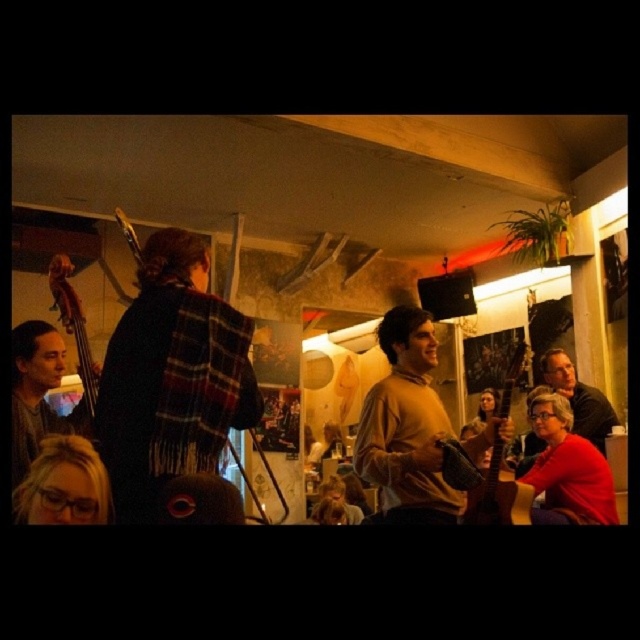
Question: Does matte brown sweater at center lie in front of matte black guitar at right?

Choices:
 (A) no
 (B) yes

Answer: (B)

Question: Which of the following is the closest to the observer?

Choices:
 (A) (88, 516)
 (B) (536, 401)
 (C) (612, 413)
 (D) (80, 316)

Answer: (A)

Question: Is wooden acoustic guitar at right below matte black double bass at left?

Choices:
 (A) yes
 (B) no

Answer: (A)

Question: Does matte black glasses at lower left appear on the right side of matte black double bass at left?

Choices:
 (A) yes
 (B) no

Answer: (A)

Question: Which object is positioned closest to the matte black glasses at lower left?

Choices:
 (A) matte black double bass at left
 (B) red matte shirt at lower right
 (C) matte black guitar at right
 (D) matte brown sweater at center

Answer: (A)

Question: Estimate the real-world distances between objects in this image. Which object is closer to the matte black double bass at left?

Choices:
 (A) matte black glasses at lower left
 (B) matte black guitar at left
 (C) red matte shirt at lower right
 (D) matte brown sweater at center

Answer: (B)